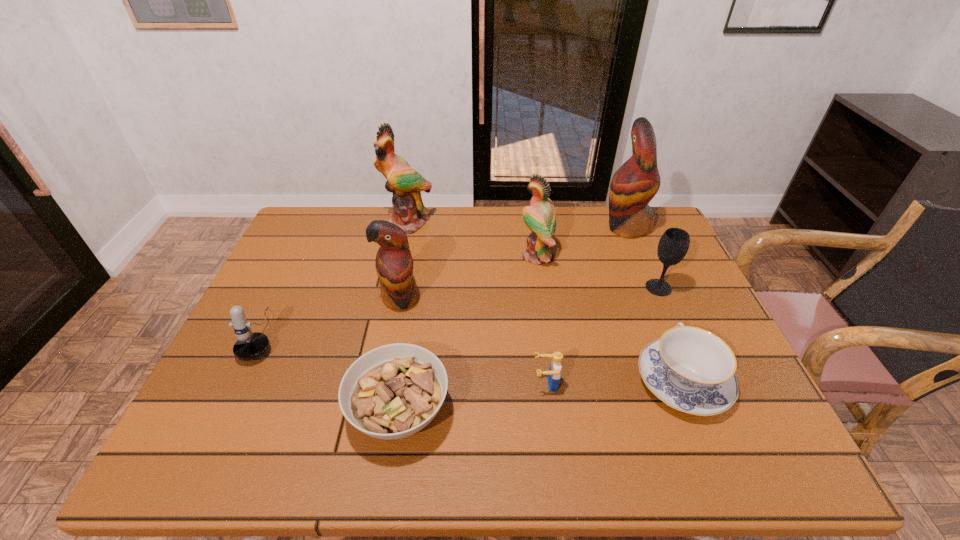
Find the location of a particular element. The width and height of the screenshot is (960, 540). free spot located 0.120m on the right of the gray stew is located at coordinates (505, 411).

Locate an element on the screen. object positioned at the near edge is located at coordinates (391, 392).

This screenshot has height=540, width=960. What are the coordinates of `object present at the left edge` in the screenshot? It's located at (249, 346).

The width and height of the screenshot is (960, 540). In order to click on parrot present at the right edge in this screenshot , I will do `click(636, 182)`.

Image resolution: width=960 pixels, height=540 pixels. I want to click on wineglass located at the right edge, so click(673, 245).

At what (x,y) coordinates should I click in order to perform the action: click on chinaware at the right edge. Please return your answer as a coordinate pair (x, y). Image resolution: width=960 pixels, height=540 pixels. Looking at the image, I should click on (690, 369).

You are a GUI agent. You are given a task and a screenshot of the screen. Output one action in this format:
    pyautogui.click(x=<x>, y=<y>)
    Task: Click on the object located at the far right corner
    Image resolution: width=960 pixels, height=540 pixels.
    Given the screenshot: What is the action you would take?
    pyautogui.click(x=636, y=182)

Image resolution: width=960 pixels, height=540 pixels. Find the location of `vacant region at the far edge of the desktop`. vacant region at the far edge of the desktop is located at coordinates coord(582,208).

Locate an element on the screen. The height and width of the screenshot is (540, 960). vacant space at the near edge of the desktop is located at coordinates (493, 450).

Locate an element on the screen. The width and height of the screenshot is (960, 540). vacant space at the left edge of the desktop is located at coordinates [x=229, y=346].